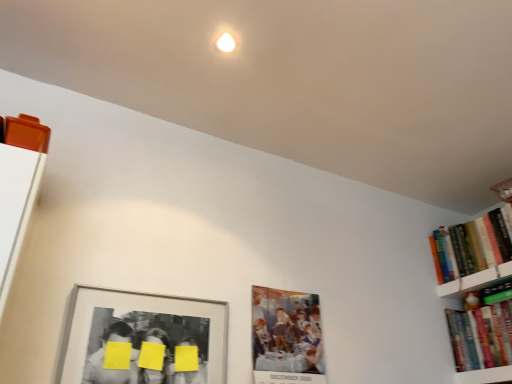
Question: In the image, is matte silver picture frame at lower left, the first picture frame positioned from the left, positioned in front of or behind hardcover books at right, positioned as the second book in bottom-to-top order?

Choices:
 (A) behind
 (B) front

Answer: (B)

Question: Would you say matte silver picture frame at lower left, placed as the second picture frame when sorted from right to left, is to the left or to the right of hardcover books at right, which is counted as the 1th book, starting from the top, in the picture?

Choices:
 (A) right
 (B) left

Answer: (B)

Question: Which object is the closest to the yellow matte paper at center?

Choices:
 (A) white glossy bookshelf at upper right
 (B) matte silver picture frame at lower left, the first picture frame positioned from the left
 (C) hardcover book at right, the second book from the top
 (D) matte paper picture frame at center, which is counted as the first picture frame, starting from the right
 (E) hardcover books at right, positioned as the second book in bottom-to-top order

Answer: (B)

Question: Estimate the real-world distances between objects in this image. Which object is farther from the matte silver picture frame at lower left, placed as the second picture frame when sorted from right to left?

Choices:
 (A) hardcover book at right, which ranks as the 1th book in bottom-to-top order
 (B) matte paper picture frame at center, which is counted as the first picture frame, starting from the right
 (C) hardcover books at right, which is counted as the 1th book, starting from the top
 (D) yellow matte paper at center
 (E) white glossy bookshelf at upper right

Answer: (E)